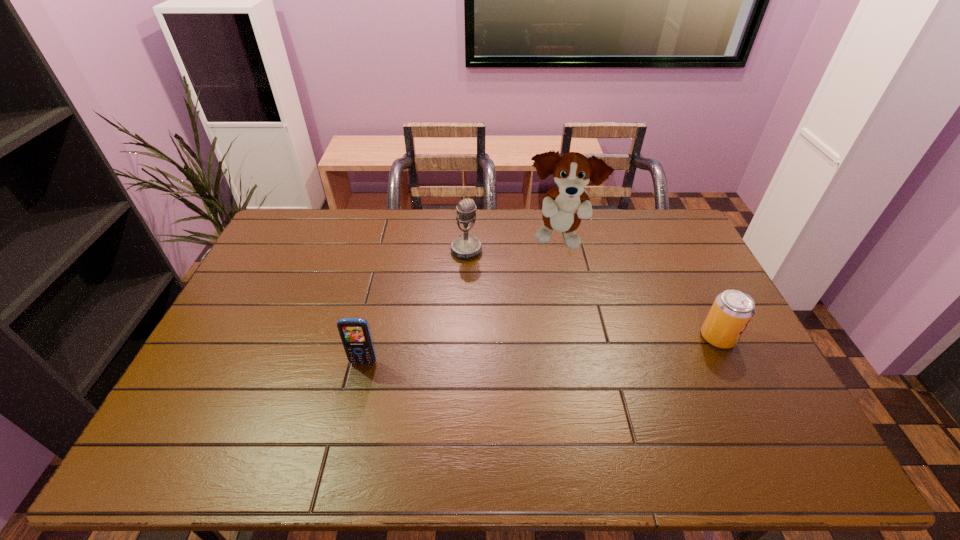
Where is `vacant space that's between the microphone and the cellular telephone`? vacant space that's between the microphone and the cellular telephone is located at coordinates (415, 306).

Find the location of a particular element. This screenshot has height=540, width=960. vacant area that lies between the nearest object and the rightmost object is located at coordinates (540, 350).

The width and height of the screenshot is (960, 540). I want to click on object identified as the closest to the microphone, so click(x=564, y=206).

Locate which object is the second closest to the second tallest object. Please provide its 2D coordinates. Your answer should be formatted as a tuple, i.e. [(x, y)], where the tuple contains the x and y coordinates of a point satisfying the conditions above.

[(355, 334)]

Where is `free location that satisfies the following two spatial constraints: 1. on the front side of the tallest object; 2. on the right side of the rightmost object`? This screenshot has width=960, height=540. free location that satisfies the following two spatial constraints: 1. on the front side of the tallest object; 2. on the right side of the rightmost object is located at coordinates (580, 338).